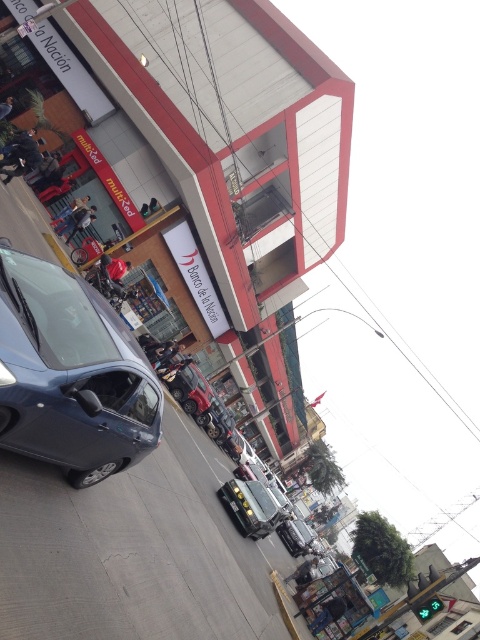
Question: Can you confirm if metallic gray car at left is positioned below metallic silver car at center?

Choices:
 (A) yes
 (B) no

Answer: (B)

Question: Which object appears farthest from the camera in this image?

Choices:
 (A) metallic gray car at left
 (B) metallic silver car at center

Answer: (B)

Question: Which object is farther from the camera taking this photo?

Choices:
 (A) metallic silver car at center
 (B) metallic gray car at left

Answer: (A)

Question: Can you confirm if metallic gray car at left is wider than metallic silver car at center?

Choices:
 (A) yes
 (B) no

Answer: (A)

Question: From the image, what is the correct spatial relationship of metallic gray car at left in relation to metallic silver car at center?

Choices:
 (A) left
 (B) right

Answer: (A)

Question: Among these objects, which one is nearest to the camera?

Choices:
 (A) metallic gray car at left
 (B) metallic silver car at center

Answer: (A)